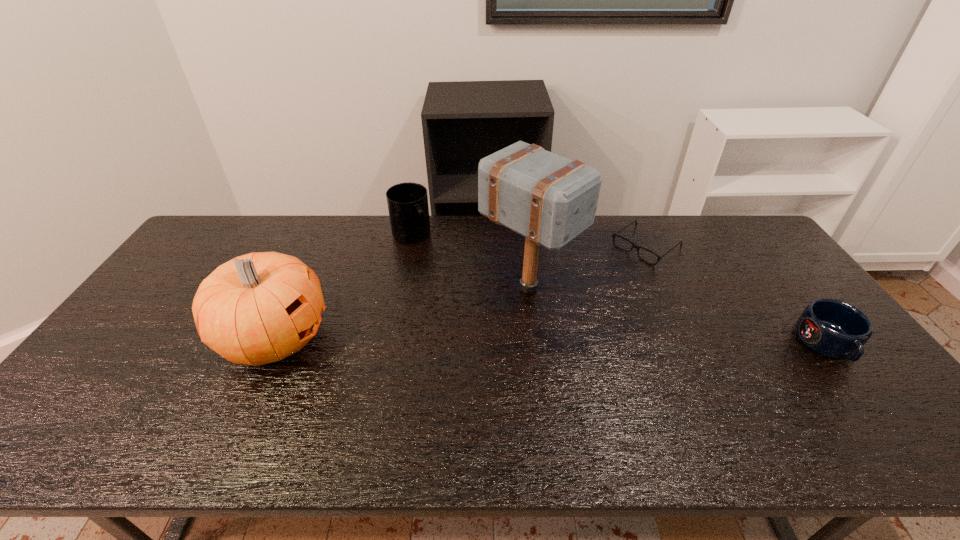
This screenshot has height=540, width=960. What are the coordinates of `vacant space on the desktop that is between the second tallest object and the rightmost object and is positioned on the striking surface of the tallest object` in the screenshot? It's located at (616, 341).

This screenshot has width=960, height=540. Find the location of `free spot on the desktop that is between the leftmost object and the shorter mug and is positioned on the side of the left mug with the handle`. free spot on the desktop that is between the leftmost object and the shorter mug and is positioned on the side of the left mug with the handle is located at coordinates (506, 340).

At what (x,y) coordinates should I click in order to perform the action: click on vacant space on the desktop that is between the pumpkin and the fourth tallest object and is positioned on the front-facing side of the spectacles. Please return your answer as a coordinate pair (x, y). Looking at the image, I should click on (526, 341).